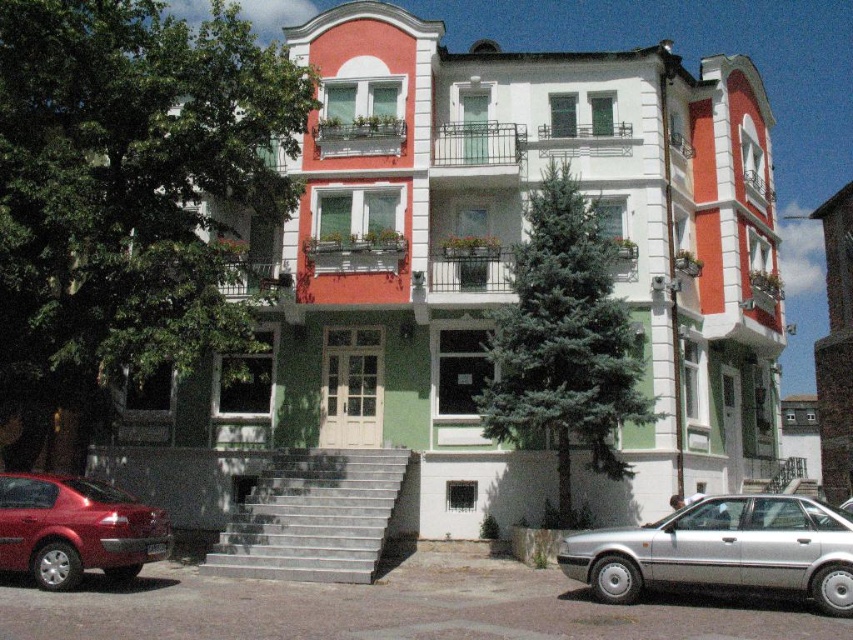
Question: In this image, where is silver metallic sedan at lower right located relative to shiny red sedan at lower left?

Choices:
 (A) left
 (B) right

Answer: (B)

Question: Which object appears farthest from the camera in this image?

Choices:
 (A) shiny red sedan at lower left
 (B) silver metallic sedan at lower right

Answer: (A)

Question: Is silver metallic sedan at lower right above shiny red sedan at lower left?

Choices:
 (A) yes
 (B) no

Answer: (B)

Question: Which of the following is the closest to the observer?

Choices:
 (A) (390, 468)
 (B) (131, 538)
 (C) (566, 572)

Answer: (B)

Question: Among these points, which one is nearest to the camera?

Choices:
 (A) (724, 515)
 (B) (114, 544)
 (C) (363, 525)

Answer: (A)

Question: Is silver metallic sedan at lower right further to camera compared to shiny red sedan at lower left?

Choices:
 (A) yes
 (B) no

Answer: (B)